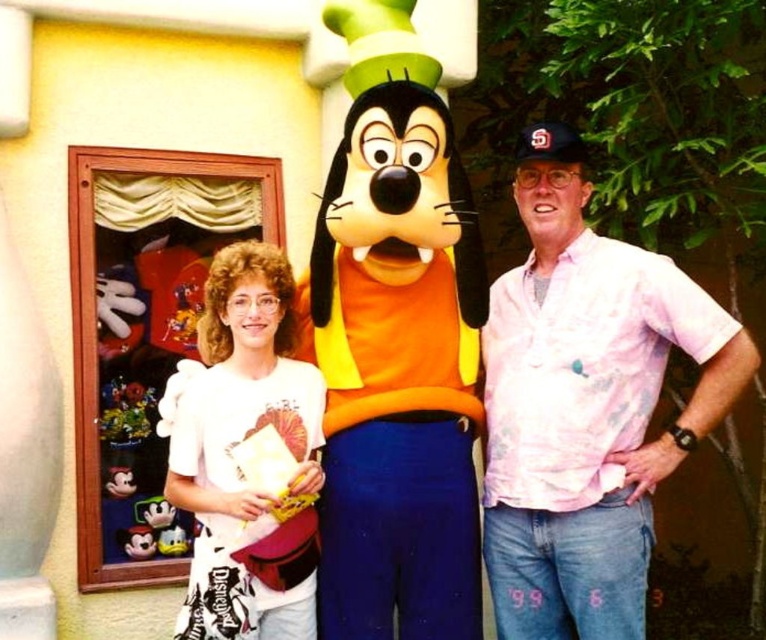
Question: Can you confirm if pink floral shirt at right is wider than white cotton shirt at left?

Choices:
 (A) no
 (B) yes

Answer: (B)

Question: Which object appears farthest from the camera in this image?

Choices:
 (A) pink floral shirt at right
 (B) white cotton shirt at left

Answer: (A)

Question: Which of the following is the farthest from the observer?

Choices:
 (A) pink floral shirt at right
 (B) white cotton shirt at left

Answer: (A)

Question: From the image, what is the correct spatial relationship of pink floral shirt at right in relation to white cotton shirt at left?

Choices:
 (A) above
 (B) below

Answer: (A)

Question: Which of the following is the farthest from the observer?

Choices:
 (A) white cotton shirt at left
 (B) pink floral shirt at right

Answer: (B)

Question: Is pink floral shirt at right positioned at the back of white cotton shirt at left?

Choices:
 (A) yes
 (B) no

Answer: (A)